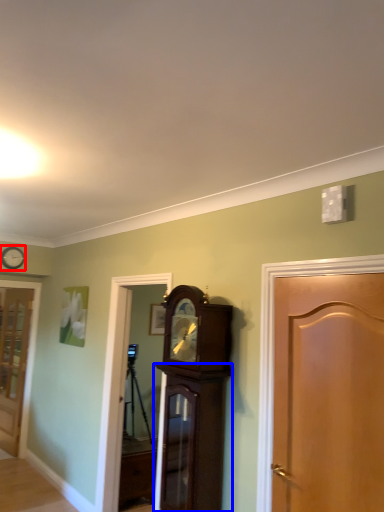
Question: Which object is closer to the camera taking this photo, clock (highlighted by a red box) or cabinetry (highlighted by a blue box)?

Choices:
 (A) clock
 (B) cabinetry

Answer: (B)